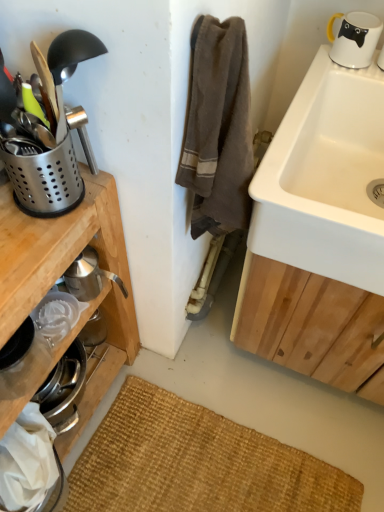
Question: Is polished stainless steel utensil holder at left, positioned as the 1th appliance in front-to-back order, bigger than white glossy mug at upper right?

Choices:
 (A) yes
 (B) no

Answer: (A)

Question: Is the position of polished stainless steel utensil holder at left, positioned as the 1th appliance in front-to-back order, more distant than that of white glossy mug at upper right?

Choices:
 (A) no
 (B) yes

Answer: (A)

Question: Does polished stainless steel utensil holder at left, positioned as the 1th appliance in front-to-back order, have a lesser height compared to white glossy mug at upper right?

Choices:
 (A) yes
 (B) no

Answer: (B)

Question: Can you confirm if polished stainless steel utensil holder at left, positioned as the 1th appliance in front-to-back order, is positioned to the left of white glossy mug at upper right?

Choices:
 (A) yes
 (B) no

Answer: (A)

Question: From a real-world perspective, is polished stainless steel utensil holder at left, positioned as the 1th appliance in front-to-back order, on top of white glossy mug at upper right?

Choices:
 (A) no
 (B) yes

Answer: (B)

Question: Based on their sizes in the image, would you say white ceramic sink at upper right is bigger or smaller than polished stainless steel utensil holder at left, which is the 2th appliance from back to front?

Choices:
 (A) small
 (B) big

Answer: (B)

Question: From a real-world perspective, is white ceramic sink at upper right positioned above or below polished stainless steel utensil holder at left, positioned as the 1th appliance in front-to-back order?

Choices:
 (A) below
 (B) above

Answer: (A)

Question: Considering the positions of point pos(278,164) and point pos(66,48), is point pos(278,164) closer or farther from the camera than point pos(66,48)?

Choices:
 (A) closer
 (B) farther

Answer: (B)

Question: Is white ceramic sink at upper right taller or shorter than polished stainless steel utensil holder at left, which is the 2th appliance from back to front?

Choices:
 (A) tall
 (B) short

Answer: (B)

Question: Is polished stainless steel utensil holder at left, positioned as the 1th appliance in front-to-back order, in front of or behind white glossy mug at upper right in the image?

Choices:
 (A) behind
 (B) front

Answer: (B)

Question: Looking at their shapes, would you say polished stainless steel utensil holder at left, positioned as the 1th appliance in front-to-back order, is wider or thinner than white glossy mug at upper right?

Choices:
 (A) wide
 (B) thin

Answer: (A)

Question: Is polished stainless steel utensil holder at left, which is the 2th appliance from back to front, taller or shorter than white glossy mug at upper right?

Choices:
 (A) short
 (B) tall

Answer: (B)

Question: In terms of size, does polished stainless steel utensil holder at left, which is the 2th appliance from back to front, appear bigger or smaller than white glossy mug at upper right?

Choices:
 (A) big
 (B) small

Answer: (A)

Question: Looking at their shapes, would you say polished stainless steel utensil holder at left, which is the 2th appliance from back to front, is wider or thinner than polished stainless steel utensil holder at left, the second appliance positioned from the front?

Choices:
 (A) thin
 (B) wide

Answer: (B)

Question: Is point (64, 190) closer or farther from the camera than point (11, 160)?

Choices:
 (A) closer
 (B) farther

Answer: (B)